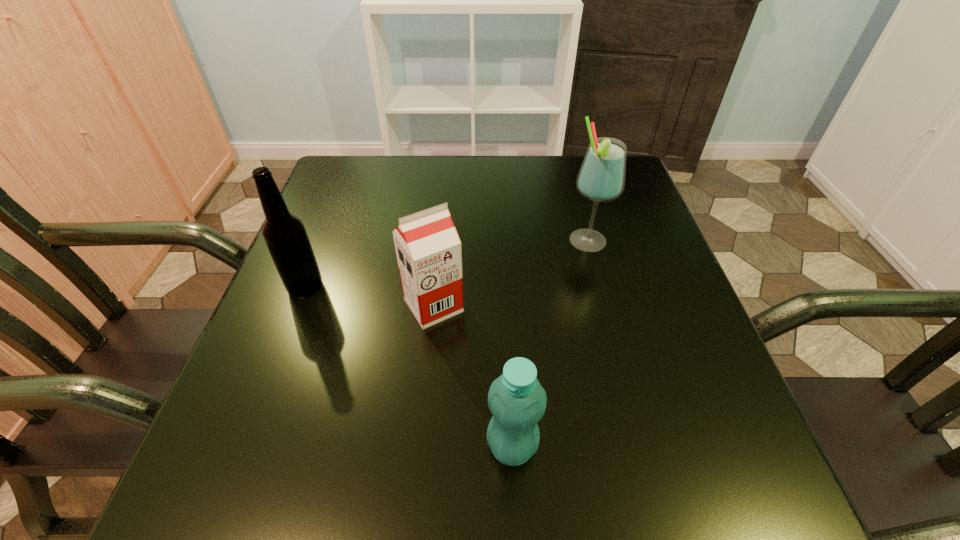
Identify the location of alcohol. (601, 178).

Locate an element on the screen. the rightmost object is located at coordinates (601, 178).

This screenshot has width=960, height=540. In order to click on the leftmost object in this screenshot , I will do `click(286, 238)`.

Find the location of a particular element. This screenshot has height=540, width=960. the second object from left to right is located at coordinates point(428,248).

Find the location of a particular element. water bottle is located at coordinates (516, 399).

Locate an element on the screen. the third object from left to right is located at coordinates (516, 399).

Image resolution: width=960 pixels, height=540 pixels. Identify the location of free space located on the front of the farthest object. pos(623,378).

Where is `vacant region located on the back of the leftmost object`? vacant region located on the back of the leftmost object is located at coordinates (324, 241).

Find the location of a particular element. The height and width of the screenshot is (540, 960). free space located on the right of the soya milk is located at coordinates (537, 306).

The width and height of the screenshot is (960, 540). I want to click on vacant area situated 0.390m at the front cap of the nearest object, so click(x=226, y=447).